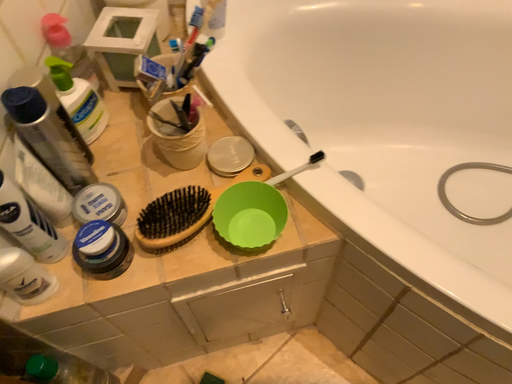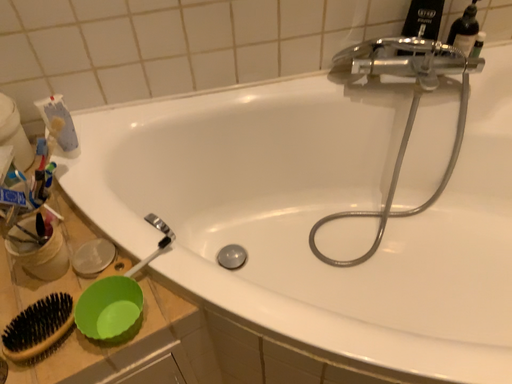
Question: Which way did the camera rotate in the video?

Choices:
 (A) rotated right
 (B) rotated left

Answer: (A)